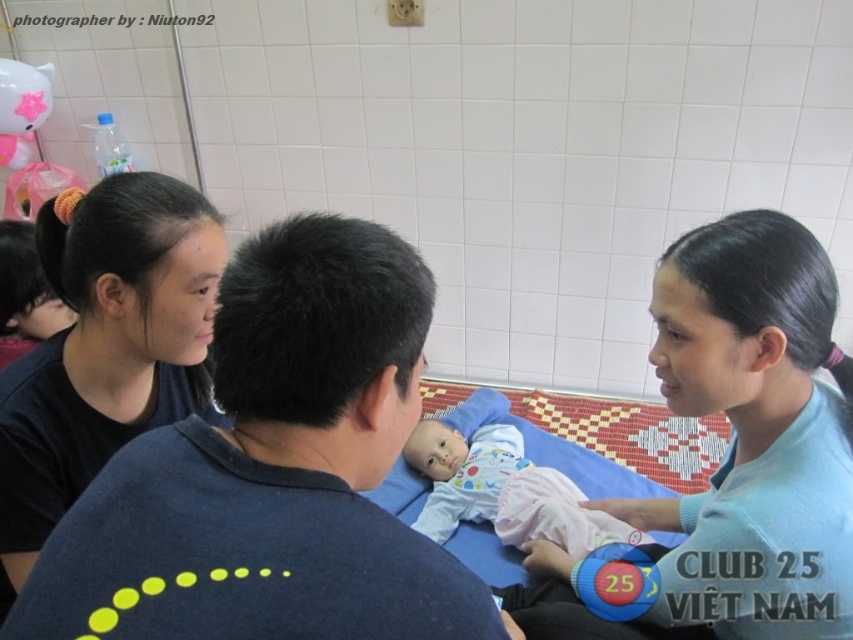
You are a nurse in the hospital and need to place a medical device at one of the two points in the image. The device must be placed closer to the viewer for easy access. Which point should you choose between point (555, 589) and point (570, 541)?

Point (555, 589) is closer to the viewer than point (570, 541), so you should choose point (555, 589) to place the medical device for easy access.

You are a nurse in the hospital. You need to check the baby lying on the bed. Which object, the black matte hair at upper left or the light pink fabric baby at center, is closer to the bed?

The light pink fabric baby at center is closer to the bed because the black matte hair at upper left is positioned over it, indicating it is above the baby and thus farther from the bed.